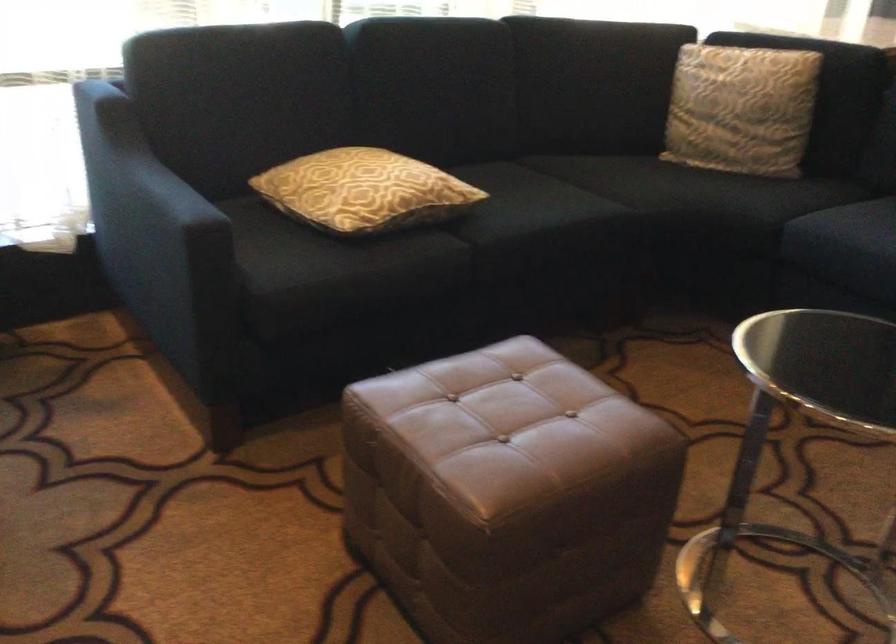
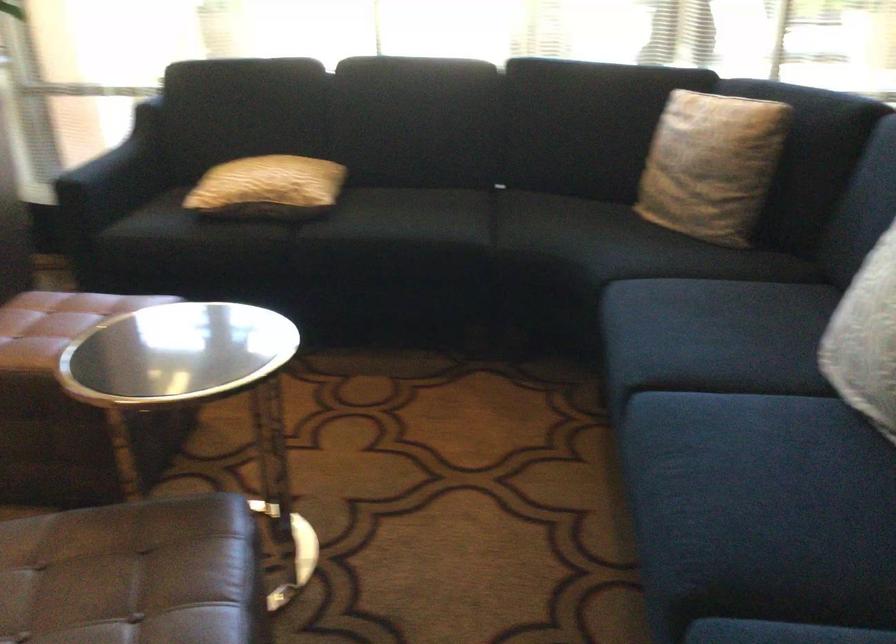
In the second image, find the point that corresponds to pixel 770 104 in the first image.

(711, 165)